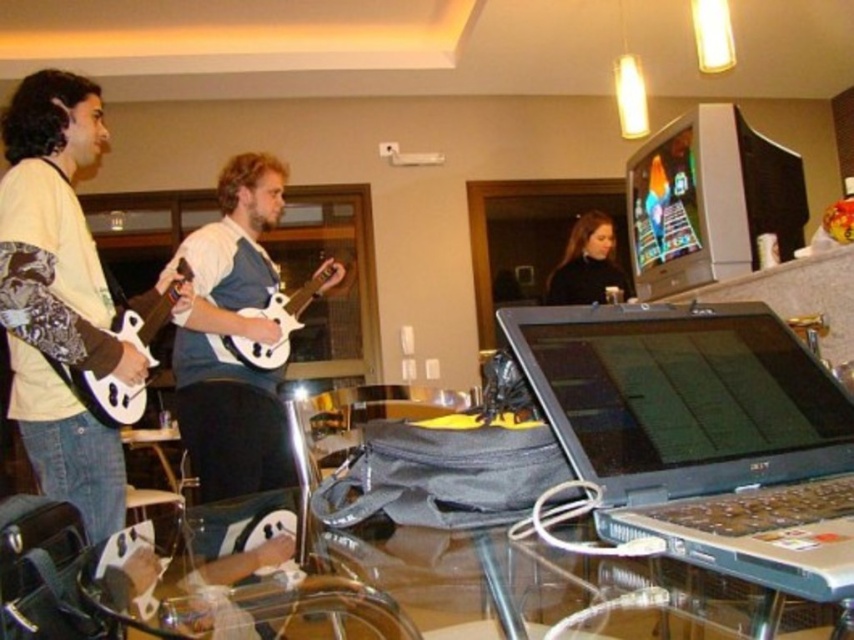
Looking at this image, you are standing in the room and want to pick up an object located at point (51, 362). If your outstretched hand can reach up to 1.6 meters, will you be able to reach it?

The distance of point (51, 362) from viewer is 1.59 meters, so yes, you can reach it since it is within the 1.6 meters range.

You are a music teacher who wants to arrange two guitars on a shelf. You have the white matte electric guitar at left and the white matte electric guitar at center. If you want to place them side by side from left to right, which guitar should be placed first on the left side?

The white matte electric guitar at left should be placed first on the left side since it is positioned to the left of the white matte electric guitar at center in the original scene.

Based on the photo, you are a photographer trying to capture a closeup of the white matte electric guitar at center without including the dark brown hair at center in the frame. Given their positions, is this possible?

The dark brown hair at center is located above the white matte electric guitar at center, so if you position the camera to focus on the guitar while angling it slightly downward, you can avoid capturing the hair in the frame.